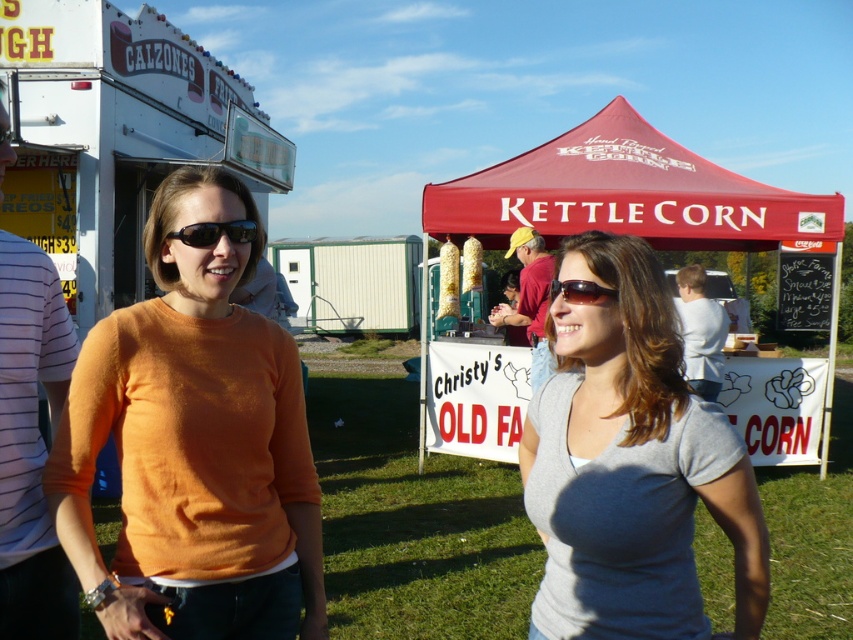
Between white striped shirt at left and black plastic sunglasses at left, which one has more height?

Standing taller between the two is white striped shirt at left.

Find the location of a particular element. This screenshot has height=640, width=853. white striped shirt at left is located at coordinates (32, 444).

Does orange sweater at left have a larger size compared to maroon fabric canopy at upper center?

No, orange sweater at left is not bigger than maroon fabric canopy at upper center.

Is orange sweater at left smaller than maroon fabric canopy at upper center?

Yes, orange sweater at left is smaller than maroon fabric canopy at upper center.

The image size is (853, 640). What do you see at coordinates (194, 444) in the screenshot?
I see `orange sweater at left` at bounding box center [194, 444].

The width and height of the screenshot is (853, 640). Identify the location of orange sweater at left. (194, 444).

Based on the photo, does maroon fabric canopy at upper center come behind matte yellow shirt at center?

Yes.

Is maroon fabric canopy at upper center positioned in front of matte yellow shirt at center?

No.

Where is `maroon fabric canopy at upper center`? Image resolution: width=853 pixels, height=640 pixels. maroon fabric canopy at upper center is located at coordinates (625, 193).